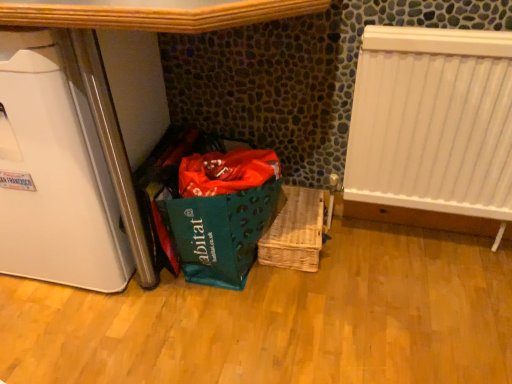
Locate an element on the screen. This screenshot has width=512, height=384. woven wood basket at center is located at coordinates (295, 231).

Where is `white plastic radiator at right`? white plastic radiator at right is located at coordinates (433, 122).

I want to click on woven wood basket at center, so click(295, 231).

Is white plastic radiator at right not within white glossy refrigerator at left?

Yes, white plastic radiator at right is outside of white glossy refrigerator at left.

Considering the relative sizes of white plastic radiator at right and white glossy refrigerator at left in the image provided, is white plastic radiator at right bigger than white glossy refrigerator at left?

Incorrect, white plastic radiator at right is not larger than white glossy refrigerator at left.

Is white plastic radiator at right wider or thinner than white glossy refrigerator at left?

In the image, white plastic radiator at right appears to be more narrow than white glossy refrigerator at left.

Is white plastic radiator at right positioned far away from white glossy refrigerator at left?

No.

From the picture: Can you tell me how much white plastic radiator at right and woven wood basket at center differ in facing direction?

They differ by 0.227 degrees in their facing directions.

Is white plastic radiator at right placed right next to woven wood basket at center?

They are not placed beside each other.

Who is smaller, white plastic radiator at right or woven wood basket at center?

Smaller between the two is woven wood basket at center.

Considering the relative positions of white plastic radiator at right and woven wood basket at center in the image provided, is white plastic radiator at right to the left or to the right of woven wood basket at center?

Based on their positions, white plastic radiator at right is located to the right of woven wood basket at center.

Between woven wood basket at center and white plastic radiator at right, which one appears on the right side from the viewer's perspective?

From the viewer's perspective, white plastic radiator at right appears more on the right side.

Can you see woven wood basket at center touching white plastic radiator at right?

woven wood basket at center is not next to white plastic radiator at right, and they're not touching.

From the image's perspective, is woven wood basket at center positioned above or below white plastic radiator at right?

From the image's perspective, woven wood basket at center appears below white plastic radiator at right.

Which is closer, (307, 269) or (430, 105)?

The point (430, 105) is closer to the camera.

From the image's perspective, is white glossy refrigerator at left above or below woven wood basket at center?

From the image's perspective, white glossy refrigerator at left appears above woven wood basket at center.

Is white glossy refrigerator at left not near woven wood basket at center?

white glossy refrigerator at left is near woven wood basket at center, not far away.

Is point (0, 86) closer to viewer compared to point (294, 247)?

Yes.

Is point (103, 122) behind point (488, 67)?

No, it is not.

Can you confirm if white glossy refrigerator at left is positioned to the left of white plastic radiator at right?

Indeed, white glossy refrigerator at left is positioned on the left side of white plastic radiator at right.

Considering their positions, is white glossy refrigerator at left located in front of or behind white plastic radiator at right?

white glossy refrigerator at left is in front of white plastic radiator at right.

From the image's perspective, which one is positioned lower, woven wood basket at center or white glossy refrigerator at left?

woven wood basket at center.

Can you confirm if woven wood basket at center is taller than white glossy refrigerator at left?

In fact, woven wood basket at center may be shorter than white glossy refrigerator at left.

Is woven wood basket at center not within white glossy refrigerator at left?

That's correct, woven wood basket at center is outside of white glossy refrigerator at left.

Which point is more distant from viewer, (273, 222) or (89, 143)?

Positioned behind is point (273, 222).

This screenshot has width=512, height=384. Identify the location of radiator lying behind the white glossy refrigerator at left. (433, 122).

Locate an element on the screen. This screenshot has width=512, height=384. radiator lying in front of the woven wood basket at center is located at coordinates (433, 122).

Which object lies nearer to the anchor point white plastic radiator at right, woven wood basket at center or white glossy refrigerator at left?

woven wood basket at center is positioned closer to the anchor white plastic radiator at right.

Looking at the image, which one is located further to woven wood basket at center, white plastic radiator at right or white glossy refrigerator at left?

white glossy refrigerator at left is positioned further to the anchor woven wood basket at center.

Looking at the image, which one is located further to white plastic radiator at right, white glossy refrigerator at left or woven wood basket at center?

Based on the image, white glossy refrigerator at left appears to be further to white plastic radiator at right.

Which object lies further to the anchor point white glossy refrigerator at left, woven wood basket at center or white plastic radiator at right?

white plastic radiator at right is positioned further to the anchor white glossy refrigerator at left.

Which object lies further to the anchor point woven wood basket at center, white glossy refrigerator at left or white plastic radiator at right?

white glossy refrigerator at left is positioned further to the anchor woven wood basket at center.

Based on their spatial positions, is white plastic radiator at right or woven wood basket at center closer to white glossy refrigerator at left?

The object closer to white glossy refrigerator at left is woven wood basket at center.

Find the location of a particular element. basket between white glossy refrigerator at left and white plastic radiator at right is located at coordinates (295, 231).